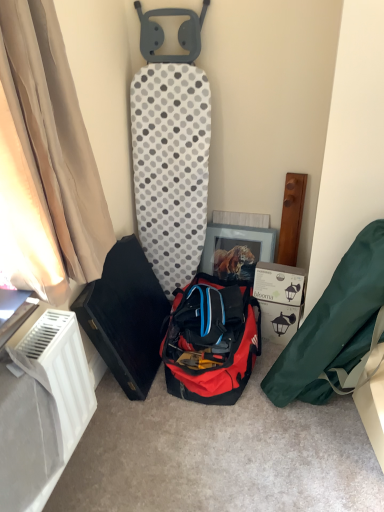
Question: Which is correct: black hard case at left, which ranks as the 1th kit in left-to-right order, is inside red fabric duffel bag at center, or outside of it?

Choices:
 (A) inside
 (B) outside

Answer: (B)

Question: Based on their sizes in the image, would you say black hard case at left, which ranks as the 1th kit in left-to-right order, is bigger or smaller than red fabric duffel bag at center?

Choices:
 (A) small
 (B) big

Answer: (B)

Question: Which is farther from the white cardboard box at lower right?

Choices:
 (A) beige fabric curtain at left
 (B) black hard case at left, the second kit in the right-to-left sequence
 (C) white plastic radiator at lower left
 (D) green fabric bag at lower right, arranged as the 2th kit when viewed from the left
 (E) red fabric duffel bag at center

Answer: (A)

Question: Considering the real-world distances, which object is farthest from the white plastic radiator at lower left?

Choices:
 (A) red fabric duffel bag at center
 (B) black hard case at left, the second kit in the right-to-left sequence
 (C) white cardboard box at lower right
 (D) green fabric bag at lower right, the first kit in the right-to-left sequence
 (E) beige fabric curtain at left

Answer: (C)